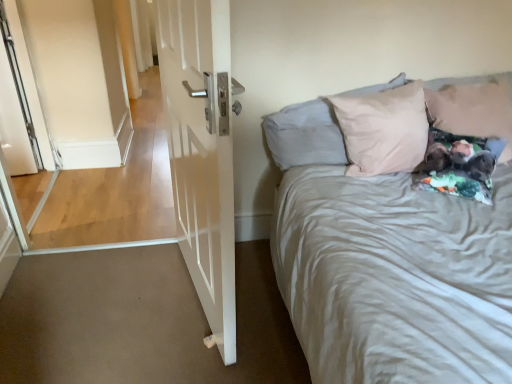
Where is `white glossy door at left`? white glossy door at left is located at coordinates (202, 151).

Is light pink fabric pillow at upper right, which is the second pillow in left-to-right order, aimed at white glossy door at left?

No, light pink fabric pillow at upper right, which is the second pillow in left-to-right order, does not turn towards white glossy door at left.

Is light pink fabric pillow at upper right, which is the second pillow in left-to-right order, next to white glossy door at left?

No, light pink fabric pillow at upper right, which is the second pillow in left-to-right order, is not next to white glossy door at left.

From the image's perspective, is light pink fabric pillow at upper right, which is the second pillow in left-to-right order, beneath white glossy door at left?

No, from the image's perspective, light pink fabric pillow at upper right, which is the second pillow in left-to-right order, is not below white glossy door at left.

From a real-world perspective, is light pink fabric pillow at upper right, which is the 1th pillow in right-to-left order, positioned over white glossy door at left based on gravity?

Yes.

Between light pink fabric pillow at upper right, the second pillow in the right-to-left sequence, and white glossy door at left, which one has smaller size?

With smaller size is light pink fabric pillow at upper right, the second pillow in the right-to-left sequence.

Is light pink fabric pillow at upper right, arranged as the 1th pillow when viewed from the left, not close to white glossy door at left?

No, light pink fabric pillow at upper right, arranged as the 1th pillow when viewed from the left, is not far from white glossy door at left.

Is light pink fabric pillow at upper right, the second pillow in the right-to-left sequence, closer to camera compared to white glossy door at left?

No, light pink fabric pillow at upper right, the second pillow in the right-to-left sequence, is further to the viewer.

Which of these two, light pink fabric pillow at upper right, arranged as the 1th pillow when viewed from the left, or white glossy door at left, stands taller?

white glossy door at left is taller.

Is light pink fabric pillow at upper right, which is the second pillow in left-to-right order, at the back of light pink fabric pillow at upper right, the second pillow in the right-to-left sequence?

No, light pink fabric pillow at upper right, the second pillow in the right-to-left sequence, is not facing the opposite direction of light pink fabric pillow at upper right, which is the second pillow in left-to-right order.

Looking at this image, considering the relative positions of light pink fabric pillow at upper right, the second pillow in the right-to-left sequence, and light pink fabric pillow at upper right, which is the 1th pillow in right-to-left order, in the image provided, is light pink fabric pillow at upper right, the second pillow in the right-to-left sequence, to the left or to the right of light pink fabric pillow at upper right, which is the 1th pillow in right-to-left order,?

light pink fabric pillow at upper right, the second pillow in the right-to-left sequence, is positioned on light pink fabric pillow at upper right, which is the 1th pillow in right-to-left order,'s left side.

In the image, is light pink fabric pillow at upper right, the second pillow in the right-to-left sequence, positioned in front of or behind light pink fabric pillow at upper right, which is the second pillow in left-to-right order?

In the image, light pink fabric pillow at upper right, the second pillow in the right-to-left sequence, appears in front of light pink fabric pillow at upper right, which is the second pillow in left-to-right order.

Is light pink fabric pillow at upper right, the second pillow in the right-to-left sequence, positioned beyond the bounds of light pink fabric pillow at upper right, which is the 1th pillow in right-to-left order?

Absolutely, light pink fabric pillow at upper right, the second pillow in the right-to-left sequence, is external to light pink fabric pillow at upper right, which is the 1th pillow in right-to-left order.

From a real-world perspective, who is located higher, white glossy door at left or light pink fabric pillow at upper right, which is the second pillow in left-to-right order?

In real-world perspective, light pink fabric pillow at upper right, which is the second pillow in left-to-right order, is above.

Considering the points (160, 40) and (460, 94), which point is behind, point (160, 40) or point (460, 94)?

The point (460, 94) is behind.

Is white glossy door at left taller or shorter than light pink fabric pillow at upper right, which is the second pillow in left-to-right order?

Considering their sizes, white glossy door at left has more height than light pink fabric pillow at upper right, which is the second pillow in left-to-right order.

How distant is white glossy door at left from light pink fabric pillow at upper right, the second pillow in the right-to-left sequence?

They are 23.15 inches apart.

The height and width of the screenshot is (384, 512). Find the location of `door located on the left of light pink fabric pillow at upper right, the second pillow in the right-to-left sequence`. door located on the left of light pink fabric pillow at upper right, the second pillow in the right-to-left sequence is located at coordinates (202, 151).

Is white glossy door at left oriented away from light pink fabric pillow at upper right, arranged as the 1th pillow when viewed from the left?

Yes, white glossy door at left is positioned with its back facing light pink fabric pillow at upper right, arranged as the 1th pillow when viewed from the left.

Which is less distant, (198, 261) or (306, 124)?

Point (198, 261) appears to be closer to the viewer than point (306, 124).

Is light pink fabric pillow at upper right, which is the second pillow in left-to-right order, oriented towards light pink fabric pillow at upper right, the second pillow in the right-to-left sequence?

No, light pink fabric pillow at upper right, which is the second pillow in left-to-right order, is not facing towards light pink fabric pillow at upper right, the second pillow in the right-to-left sequence.

Does light pink fabric pillow at upper right, which is the 1th pillow in right-to-left order, have a greater width compared to light pink fabric pillow at upper right, arranged as the 1th pillow when viewed from the left?

Incorrect, the width of light pink fabric pillow at upper right, which is the 1th pillow in right-to-left order, does not surpass that of light pink fabric pillow at upper right, arranged as the 1th pillow when viewed from the left.

Identify the location of pillow in front of the light pink fabric pillow at upper right, which is the 1th pillow in right-to-left order. (305, 135).

Which of these two, light pink fabric pillow at upper right, which is the 1th pillow in right-to-left order, or light pink fabric pillow at upper right, arranged as the 1th pillow when viewed from the left, stands shorter?

light pink fabric pillow at upper right, which is the 1th pillow in right-to-left order.

Find the location of a particular element. The image size is (512, 384). door on the left of light pink fabric pillow at upper right, which is the second pillow in left-to-right order is located at coordinates (202, 151).

Identify the location of door in front of the light pink fabric pillow at upper right, arranged as the 1th pillow when viewed from the left. The image size is (512, 384). (202, 151).

When comparing their distances from white glossy door at left, does light pink fabric pillow at upper right, which is the 1th pillow in right-to-left order, or light pink fabric pillow at upper right, the second pillow in the right-to-left sequence, seem closer?

Based on the image, light pink fabric pillow at upper right, the second pillow in the right-to-left sequence, appears to be nearer to white glossy door at left.

Considering their positions, is white glossy door at left positioned closer to light pink fabric pillow at upper right, which is the 1th pillow in right-to-left order, than light pink fabric pillow at upper right, the second pillow in the right-to-left sequence?

light pink fabric pillow at upper right, the second pillow in the right-to-left sequence, is closer to light pink fabric pillow at upper right, which is the 1th pillow in right-to-left order.

Estimate the real-world distances between objects in this image. Which object is closer to light pink fabric pillow at upper right, the second pillow in the right-to-left sequence, light pink fabric pillow at upper right, which is the 1th pillow in right-to-left order, or white glossy door at left?

Based on the image, light pink fabric pillow at upper right, which is the 1th pillow in right-to-left order, appears to be nearer to light pink fabric pillow at upper right, the second pillow in the right-to-left sequence.

Estimate the real-world distances between objects in this image. Which object is further from light pink fabric pillow at upper right, which is the 1th pillow in right-to-left order, light pink fabric pillow at upper right, the second pillow in the right-to-left sequence, or white glossy door at left?

white glossy door at left.

Which object lies further to the anchor point white glossy door at left, light pink fabric pillow at upper right, arranged as the 1th pillow when viewed from the left, or light pink fabric pillow at upper right, which is the second pillow in left-to-right order?

light pink fabric pillow at upper right, which is the second pillow in left-to-right order.

From the image, which object appears to be farther from light pink fabric pillow at upper right, arranged as the 1th pillow when viewed from the left, white glossy door at left or light pink fabric pillow at upper right, which is the 1th pillow in right-to-left order?

Based on the image, white glossy door at left appears to be further to light pink fabric pillow at upper right, arranged as the 1th pillow when viewed from the left.

Locate an element on the screen. pillow between white glossy door at left and light pink fabric pillow at upper right, which is the second pillow in left-to-right order is located at coordinates (305, 135).